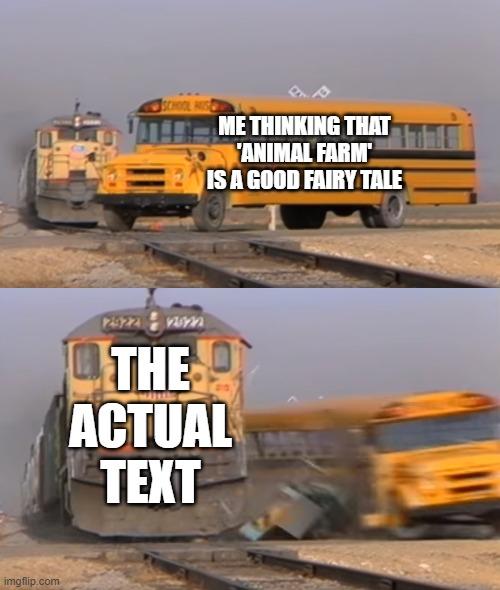
Find the location of a particular element. metal track is located at coordinates pos(426,583), pos(342,266).